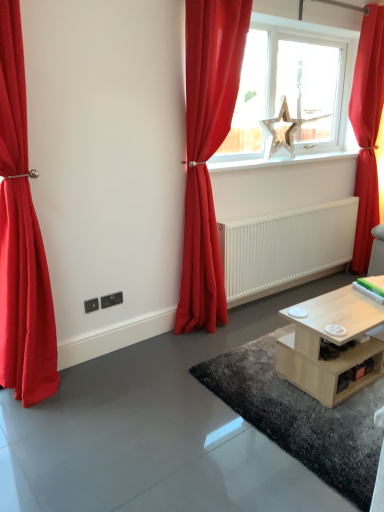
Question: From a real-world perspective, is white glossy radiator at center on top of matte red curtain at center, which is the 2th curtain in right-to-left order?

Choices:
 (A) yes
 (B) no

Answer: (A)

Question: Considering the relative sizes of white glossy radiator at center and matte red curtain at center, which is the 2th curtain in right-to-left order, in the image provided, is white glossy radiator at center shorter than matte red curtain at center, which is the 2th curtain in right-to-left order,?

Choices:
 (A) no
 (B) yes

Answer: (B)

Question: Can you confirm if white glossy radiator at center is bigger than matte red curtain at center, which is the 2th curtain in right-to-left order?

Choices:
 (A) yes
 (B) no

Answer: (B)

Question: From the image's perspective, does white glossy radiator at center appear lower than matte red curtain at center, the 2th curtain in the left-to-right sequence?

Choices:
 (A) no
 (B) yes

Answer: (A)

Question: Can you confirm if white glossy radiator at center is smaller than matte red curtain at center, the 2th curtain in the left-to-right sequence?

Choices:
 (A) yes
 (B) no

Answer: (A)

Question: Does white glossy radiator at center have a greater width compared to matte red curtain at center, which is the 2th curtain in right-to-left order?

Choices:
 (A) yes
 (B) no

Answer: (A)

Question: Is white glossy radiator at center facing towards wooden star at center?

Choices:
 (A) yes
 (B) no

Answer: (B)

Question: Is the depth of white glossy radiator at center less than that of wooden star at center?

Choices:
 (A) no
 (B) yes

Answer: (B)

Question: From a real-world perspective, is white glossy radiator at center on wooden star at center?

Choices:
 (A) no
 (B) yes

Answer: (A)

Question: Can wooden star at center be found inside white glossy radiator at center?

Choices:
 (A) no
 (B) yes

Answer: (A)

Question: Considering the relative sizes of white glossy radiator at center and wooden star at center in the image provided, is white glossy radiator at center taller than wooden star at center?

Choices:
 (A) no
 (B) yes

Answer: (A)

Question: Considering the relative positions of white glossy radiator at center and wooden star at center in the image provided, is white glossy radiator at center to the right of wooden star at center from the viewer's perspective?

Choices:
 (A) yes
 (B) no

Answer: (B)

Question: Does matte red curtain at left, the 3th curtain from the right, have a larger size compared to shiny wooden coffee table at lower center?

Choices:
 (A) yes
 (B) no

Answer: (A)